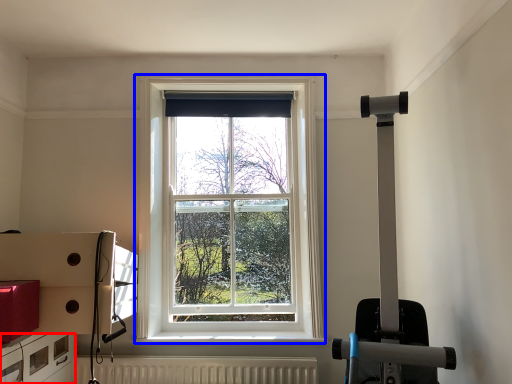
Question: Which object appears closest to the camera in this image, drawer (highlighted by a red box) or window (highlighted by a blue box)?

Choices:
 (A) drawer
 (B) window

Answer: (A)